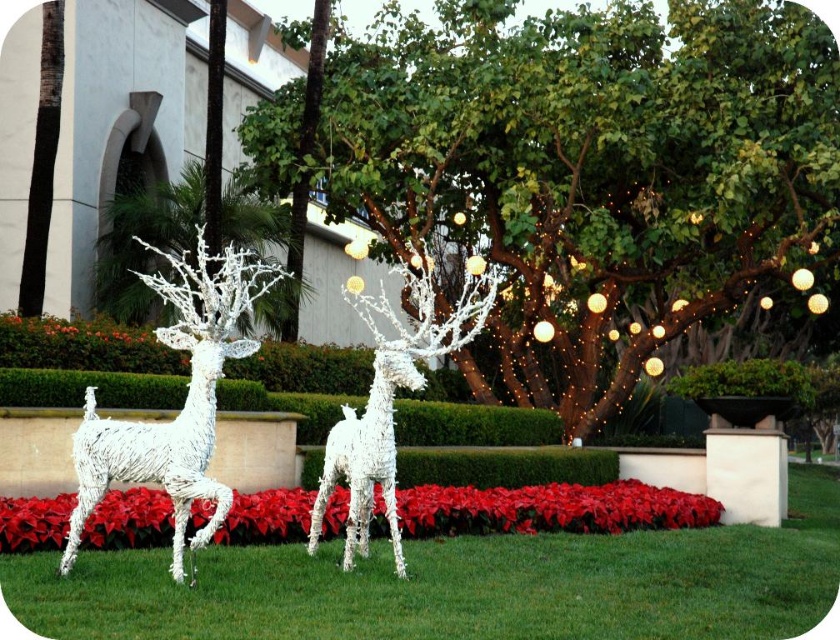
Does green grass at center have a greater height compared to white wire tree at left?

Correct, green grass at center is much taller as white wire tree at left.

Is point (458, 580) farther from viewer compared to point (282, 314)?

No.

The image size is (840, 640). Describe the element at coordinates (463, 586) in the screenshot. I see `green grass at center` at that location.

This screenshot has height=640, width=840. Identify the location of green grass at center. (463, 586).

Which is in front, point (189, 500) or point (134, 211)?

Positioned in front is point (189, 500).

Who is more distant from viewer, (213,314) or (126,209)?

Positioned behind is point (126,209).

Does point (186, 324) come in front of point (186, 259)?

Yes, point (186, 324) is closer to viewer.

The height and width of the screenshot is (640, 840). Find the location of `white wireframe deer at center`. white wireframe deer at center is located at coordinates (184, 401).

Who is positioned more to the left, green leafy tree at center or white wire tree at left?

Positioned to the left is white wire tree at left.

What do you see at coordinates (580, 168) in the screenshot? This screenshot has height=640, width=840. I see `green leafy tree at center` at bounding box center [580, 168].

Who is more distant from viewer, (x=549, y=228) or (x=264, y=227)?

Point (x=264, y=227)

What are the coordinates of `green leafy tree at center` in the screenshot? It's located at (580, 168).